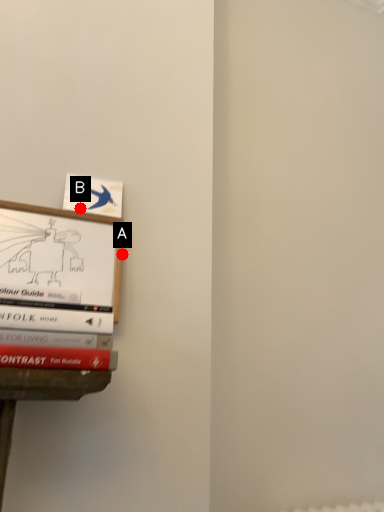
Question: Two points are circled on the image, labeled by A and B beside each circle. Among these points, which one is nearest to the camera?

Choices:
 (A) A is closer
 (B) B is closer

Answer: (B)